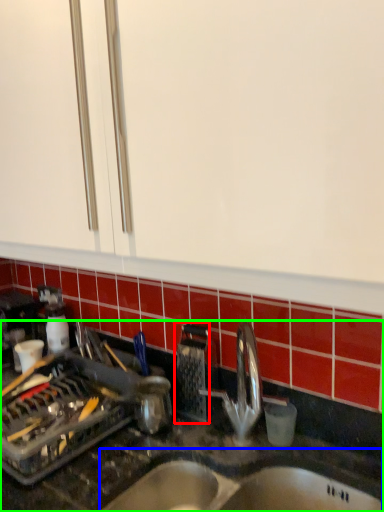
Question: Which object is positioned closest to appliance (highlighted by a red box)? Select from sink (highlighted by a blue box) and countertop (highlighted by a green box).

Choices:
 (A) sink
 (B) countertop

Answer: (B)